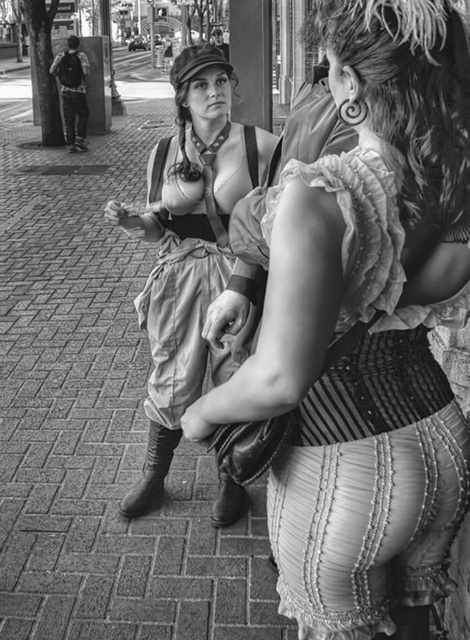
Is ruffled fabric dress at center taller than leather boot at lower left?

Yes, ruffled fabric dress at center is taller than leather boot at lower left.

Between point (175, 234) and point (135, 500), which one is positioned in front?

Point (175, 234)

Describe the element at coordinates (186, 296) in the screenshot. I see `ruffled fabric dress at center` at that location.

The height and width of the screenshot is (640, 470). What are the coordinates of `ruffled fabric dress at center` in the screenshot? It's located at (186, 296).

What do you see at coordinates (367, 330) in the screenshot? This screenshot has width=470, height=640. I see `matte leather purse at center` at bounding box center [367, 330].

Can you confirm if matte leather purse at center is positioned to the right of leather boot at lower left?

Indeed, matte leather purse at center is positioned on the right side of leather boot at lower left.

Is point (277, 497) in front of point (148, 451)?

Yes.

You are a GUI agent. You are given a task and a screenshot of the screen. Output one action in this format:
    pyautogui.click(x=<x>, y=<y>)
    Task: Click on the matte leather purse at center
    The width and height of the screenshot is (470, 640).
    Given the screenshot: What is the action you would take?
    pyautogui.click(x=367, y=330)

Which is more to the right, leather boot at lower left or leather boot at center?

Result: leather boot at center is more to the right.

Is leather boot at lower left wider than leather boot at center?

Yes.

Between point (146, 506) and point (236, 516), which one is positioned in front?

Point (236, 516)

Find the location of `leather boot at lower left`. leather boot at lower left is located at coordinates (151, 472).